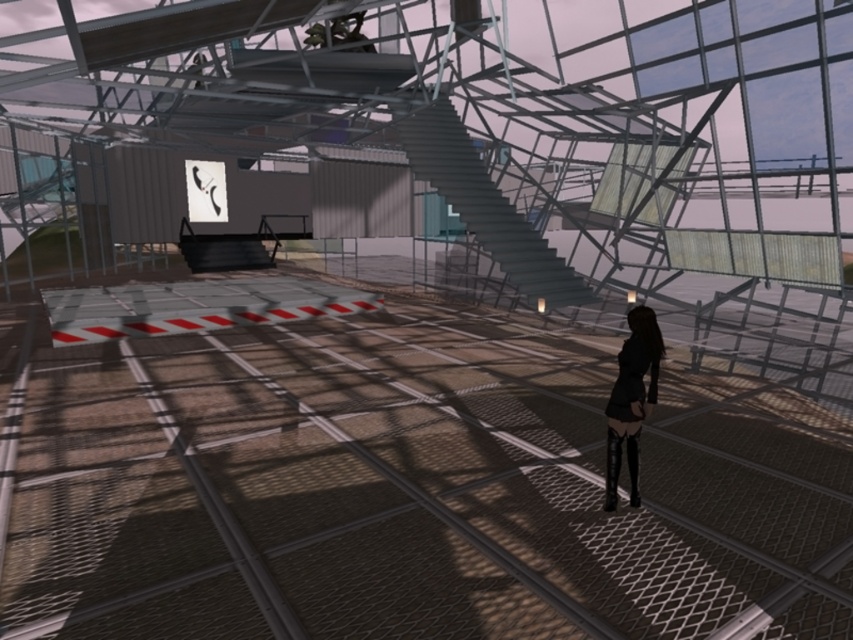
Does metallic gray staircase at center have a smaller size compared to black leather dress at lower right?

Incorrect, metallic gray staircase at center is not smaller in size than black leather dress at lower right.

Is point (506, 211) behind point (648, 376)?

Yes, point (506, 211) is behind point (648, 376).

Does point (466, 157) come behind point (660, 349)?

Yes.

What are the coordinates of `metallic gray staircase at center` in the screenshot? It's located at (485, 205).